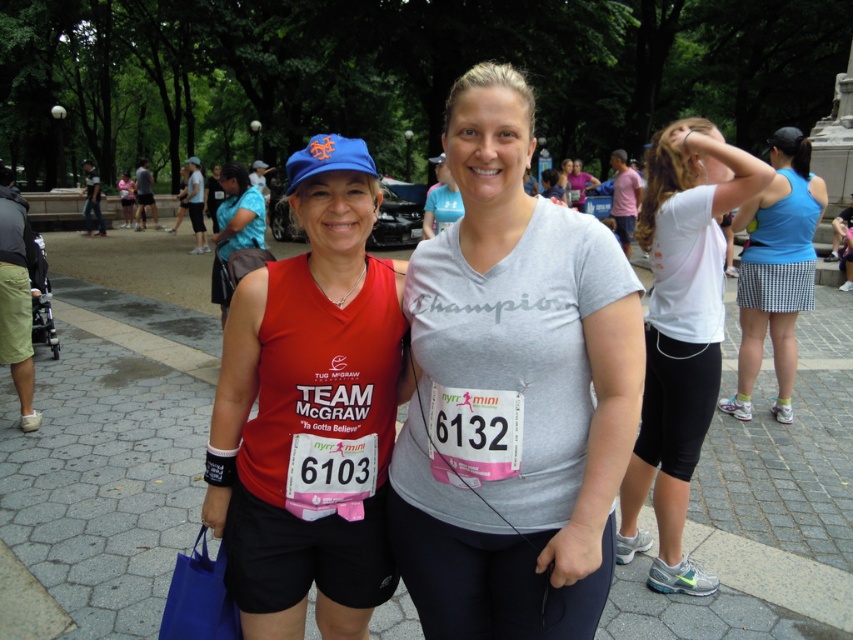
In the scene shown: Can you confirm if matte red tank top at center is positioned below blue houndstooth skirt at right?

Indeed, matte red tank top at center is positioned under blue houndstooth skirt at right.

Between point (329, 605) and point (772, 138), which one is positioned in front?

Point (329, 605) is more forward.

Is point (361, 600) positioned in front of point (756, 218)?

Yes, point (361, 600) is closer to viewer.

Identify the location of matte red tank top at center. [x=311, y=412].

Between gray matte t-shirt at center and matte blue cap at upper left, which one has less height?

matte blue cap at upper left

Measure the distance between point (637,412) and camera.

5.69 feet

Where is `gray matte t-shirt at center`? The width and height of the screenshot is (853, 640). gray matte t-shirt at center is located at coordinates (512, 392).

Between point (531, 365) and point (395, 310), which one is positioned in front?

Positioned in front is point (531, 365).

Does point (582, 259) come farther from viewer compared to point (316, 442)?

That is False.

The height and width of the screenshot is (640, 853). Identify the location of gray matte t-shirt at center. (512, 392).